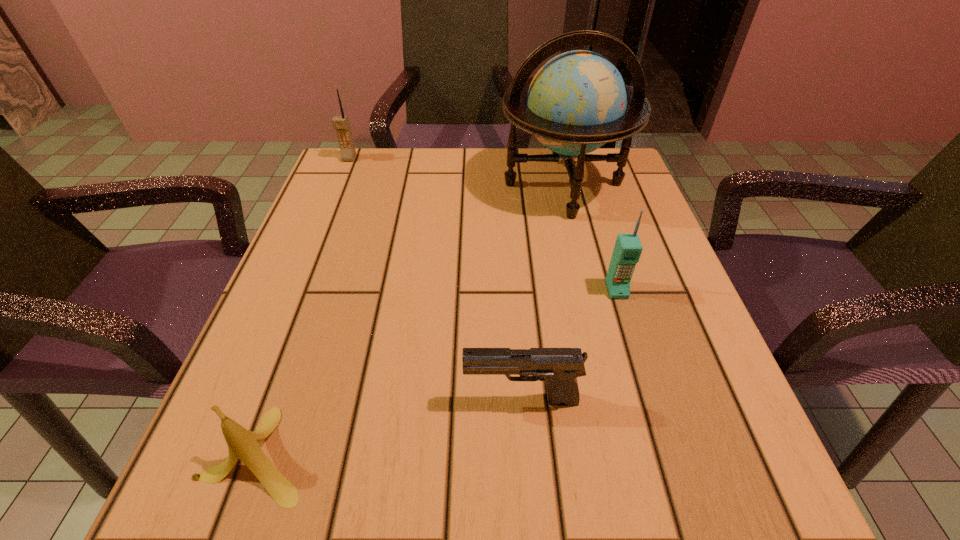
I want to click on object at the far left corner, so click(341, 124).

Where is `object that is at the near left corner`? object that is at the near left corner is located at coordinates (243, 444).

Identify the location of object located at the far right corner. (577, 102).

In the image, there is a desktop. Identify the location of blank space at the far edge. (416, 151).

Where is `blank space at the near edge`? blank space at the near edge is located at coordinates (366, 505).

Image resolution: width=960 pixels, height=540 pixels. I want to click on free region at the left edge of the desktop, so click(x=303, y=344).

This screenshot has height=540, width=960. In the image, there is a desktop. Find the location of `vacant space at the right edge`. vacant space at the right edge is located at coordinates (671, 280).

This screenshot has height=540, width=960. In order to click on vacant space at the far left corner of the desktop in this screenshot , I will do `click(391, 155)`.

This screenshot has width=960, height=540. I want to click on blank space at the far right corner of the desktop, so click(614, 189).

In the image, there is a desktop. Where is `free space at the near right corner`? This screenshot has width=960, height=540. free space at the near right corner is located at coordinates (644, 460).